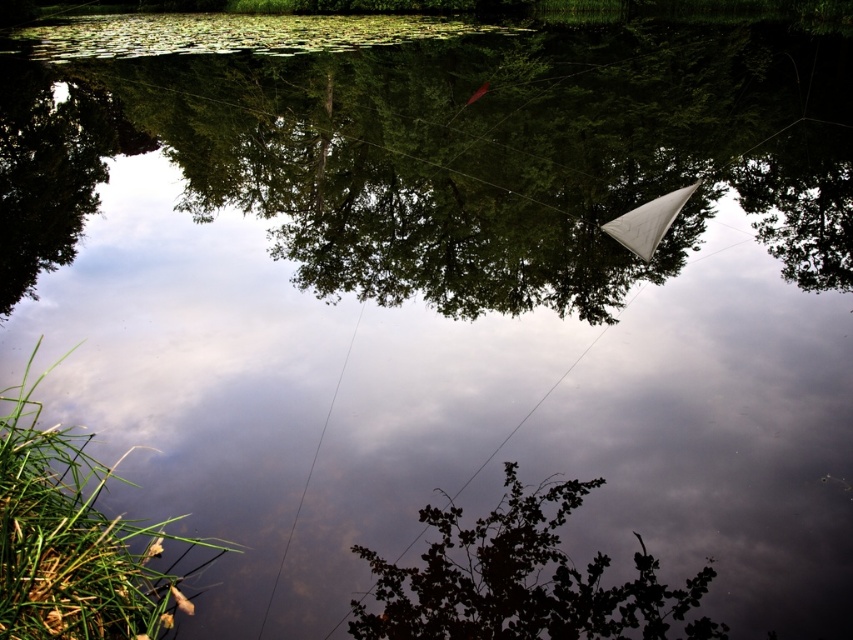
You are a photographer trying to capture the reflection of the dark green leafy tree at center and the clear wire at center in the water. Which object will have a more distorted reflection due to its size?

The clear wire at center will have a more distorted reflection because it is smaller than the dark green leafy tree at center, making it more susceptible to the water surface disturbances.